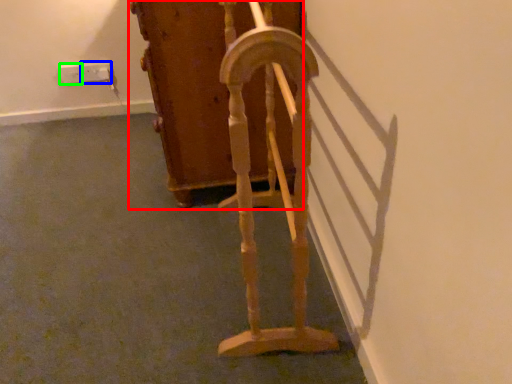
Question: Which is nearer to the furniture (highlighted by a red box)? electric outlet (highlighted by a blue box) or electric outlet (highlighted by a green box).

Choices:
 (A) electric outlet
 (B) electric outlet

Answer: (A)